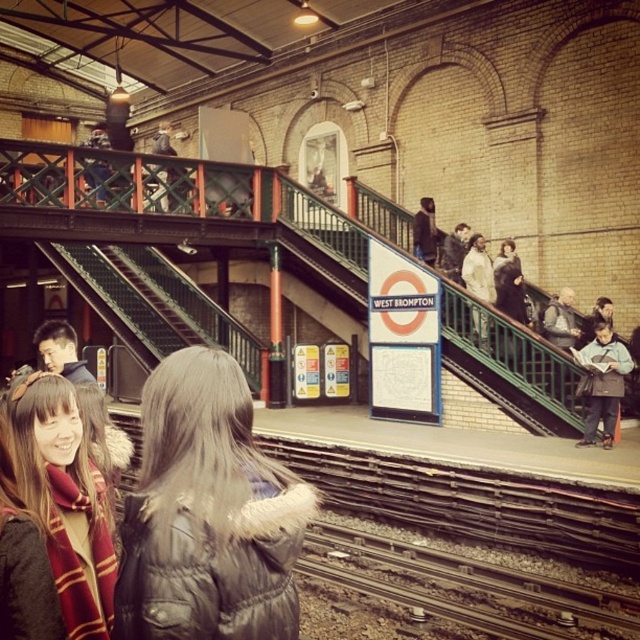
Question: Estimate the real-world distances between objects in this image. Which object is farther from the light blue fabric jacket at right?

Choices:
 (A) black leather jacket at center
 (B) red plaid scarf at lower left

Answer: (B)

Question: Which object appears closest to the camera in this image?

Choices:
 (A) light blue fabric jacket at right
 (B) red plaid scarf at lower left
 (C) black leather jacket at center

Answer: (C)

Question: Among these points, which one is farthest from the camera?

Choices:
 (A) (616, 419)
 (B) (20, 497)
 (C) (179, 477)

Answer: (A)

Question: Does black leather jacket at center come behind light blue fabric jacket at right?

Choices:
 (A) yes
 (B) no

Answer: (B)

Question: Can you confirm if black leather jacket at center is thinner than red plaid scarf at lower left?

Choices:
 (A) yes
 (B) no

Answer: (B)

Question: Can you confirm if black leather jacket at center is wider than light blue fabric jacket at right?

Choices:
 (A) no
 (B) yes

Answer: (B)